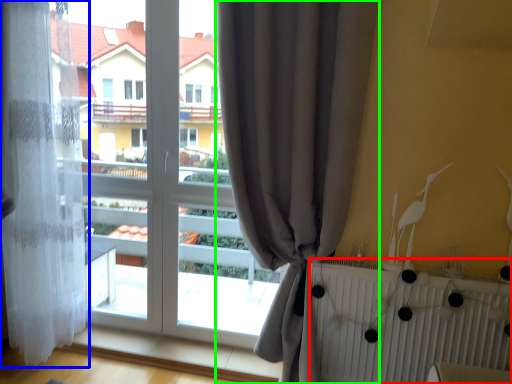
Question: Which object is the farthest from radiator (highlighted by a red box)? Choose among these: curtain (highlighted by a blue box) or curtain (highlighted by a green box).

Choices:
 (A) curtain
 (B) curtain

Answer: (A)